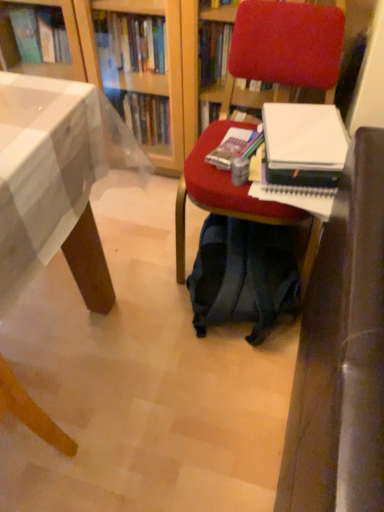
Identify the location of dark blue fabric backpack at center. The width and height of the screenshot is (384, 512). (243, 276).

In order to face wooden desk at lower left, should I rotate leftwards or rightwards?

Turn left approximately 28.196 degrees to face it.

What do you see at coordinates (287, 45) in the screenshot? I see `velvet red chair at center` at bounding box center [287, 45].

Locate an element on the screen. white paper at center right is located at coordinates (302, 156).

Consider the image. Considering the relative sizes of dark blue fabric backpack at center and velvet red chair at center in the image provided, is dark blue fabric backpack at center shorter than velvet red chair at center?

Indeed, dark blue fabric backpack at center has a lesser height compared to velvet red chair at center.

Which of these two, dark blue fabric backpack at center or velvet red chair at center, is bigger?

velvet red chair at center is bigger.

From the image's perspective, is dark blue fabric backpack at center over velvet red chair at center?

Incorrect, from the image's perspective, dark blue fabric backpack at center is lower than velvet red chair at center.

Measure the distance between dark blue fabric backpack at center and wooden desk at lower left.

dark blue fabric backpack at center and wooden desk at lower left are 48.44 centimeters apart.

Would you say wooden desk at lower left is part of dark blue fabric backpack at center's contents?

No.

From a real-world perspective, is dark blue fabric backpack at center on top of wooden desk at lower left?

Incorrect, from a real-world perspective, dark blue fabric backpack at center is lower than wooden desk at lower left.

Does dark blue fabric backpack at center turn towards wooden desk at lower left?

No, dark blue fabric backpack at center is not oriented towards wooden desk at lower left.

Looking at this image, is wooden desk at lower left directly adjacent to dark blue fabric backpack at center?

wooden desk at lower left and dark blue fabric backpack at center are clearly separated.

Is wooden desk at lower left oriented away from dark blue fabric backpack at center?

That's not correct — wooden desk at lower left is not looking away from dark blue fabric backpack at center.

How many degrees apart are the facing directions of wooden desk at lower left and dark blue fabric backpack at center?

The angle between the facing direction of wooden desk at lower left and the facing direction of dark blue fabric backpack at center is 6.54 degrees.

From a real-world perspective, is wooden desk at lower left on dark blue fabric backpack at center?

Correct, in the physical world, wooden desk at lower left is higher than dark blue fabric backpack at center.

Is white paper at center right looking in the opposite direction of wooden desk at lower left?

white paper at center right does not have its back to wooden desk at lower left.

From a real-world perspective, between white paper at center right and wooden desk at lower left, who is vertically higher?

white paper at center right, from a real-world perspective.

In the image, there is a white paper at center right. At what (x,y) coordinates should I click in order to perform the action: click on desk below it (from the image's perspective). Please return your answer as a coordinate pair (x, y). Looking at the image, I should click on (47, 190).

Can you confirm if velvet red chair at center is bigger than dark blue fabric backpack at center?

Indeed, velvet red chair at center has a larger size compared to dark blue fabric backpack at center.

In the scene shown: Is the depth of velvet red chair at center less than that of dark blue fabric backpack at center?

Yes.

What's the angular difference between velvet red chair at center and dark blue fabric backpack at center's facing directions?

There is a 83.2-degree angle between the facing directions of velvet red chair at center and dark blue fabric backpack at center.

Is point (255, 70) farther from camera compared to point (273, 151)?

Yes, point (255, 70) is behind point (273, 151).

At what (x,y) coordinates should I click in order to perform the action: click on paperback book below the velvet red chair at center (from the image's perspective). Please return your answer as a coordinate pair (x, y). This screenshot has height=512, width=384. Looking at the image, I should click on (302, 156).

Is white paper at center right surrounded by velvet red chair at center?

Yes, velvet red chair at center is surrounding white paper at center right.

Who is shorter, velvet red chair at center or white paper at center right?

white paper at center right is shorter.

Does dark blue fabric backpack at center have a greater height compared to white paper at center right?

Yes, dark blue fabric backpack at center is taller than white paper at center right.

Considering the sizes of objects dark blue fabric backpack at center and white paper at center right in the image provided, who is smaller, dark blue fabric backpack at center or white paper at center right?

Smaller between the two is white paper at center right.

Are dark blue fabric backpack at center and white paper at center right far apart?

dark blue fabric backpack at center is near white paper at center right, not far away.

In order to click on backpack behind the velvet red chair at center in this screenshot , I will do `click(243, 276)`.

This screenshot has height=512, width=384. There is a dark blue fabric backpack at center. Identify the location of desk above it (from a real-world perspective). (47, 190).

Estimate the real-world distances between objects in this image. Which object is closer to dark blue fabric backpack at center, white paper at center right or wooden desk at lower left?

Based on the image, white paper at center right appears to be nearer to dark blue fabric backpack at center.

Considering their positions, is wooden desk at lower left positioned further to white paper at center right than velvet red chair at center?

The object further to white paper at center right is wooden desk at lower left.

From the image, which object appears to be nearer to wooden desk at lower left, white paper at center right or velvet red chair at center?

Among the two, velvet red chair at center is located nearer to wooden desk at lower left.

Considering their positions, is dark blue fabric backpack at center positioned further to velvet red chair at center than wooden desk at lower left?

wooden desk at lower left is positioned further to the anchor velvet red chair at center.

Which object lies further to the anchor point dark blue fabric backpack at center, velvet red chair at center or wooden desk at lower left?

The object further to dark blue fabric backpack at center is wooden desk at lower left.

From the image, which object appears to be farther from white paper at center right, velvet red chair at center or dark blue fabric backpack at center?

dark blue fabric backpack at center.

Estimate the real-world distances between objects in this image. Which object is further from dark blue fabric backpack at center, wooden desk at lower left or white paper at center right?

The object further to dark blue fabric backpack at center is wooden desk at lower left.

Estimate the real-world distances between objects in this image. Which object is further from white paper at center right, dark blue fabric backpack at center or velvet red chair at center?

dark blue fabric backpack at center lies further to white paper at center right than the other object.

This screenshot has height=512, width=384. Identify the location of chair between wooden desk at lower left and white paper at center right in the horizontal direction. (287, 45).

Identify the location of paperback book that lies between velvet red chair at center and dark blue fabric backpack at center from top to bottom. (302, 156).

What are the coordinates of `paperback book between wooden desk at lower left and dark blue fabric backpack at center along the z-axis` in the screenshot? It's located at (302, 156).

Locate an element on the screen. This screenshot has width=384, height=512. chair located between wooden desk at lower left and dark blue fabric backpack at center in the depth direction is located at coordinates (287, 45).